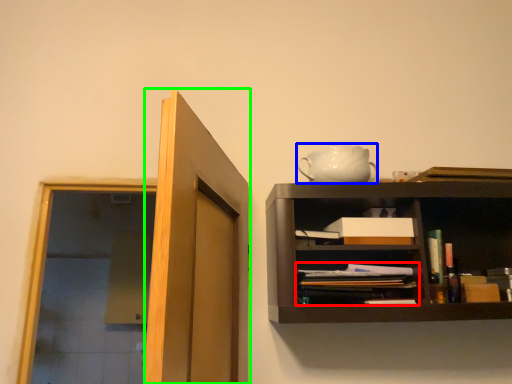
Question: Which object is the closest to the book (highlighted by a red box)? Choose among these: tea pot (highlighted by a blue box) or door (highlighted by a green box).

Choices:
 (A) tea pot
 (B) door

Answer: (A)